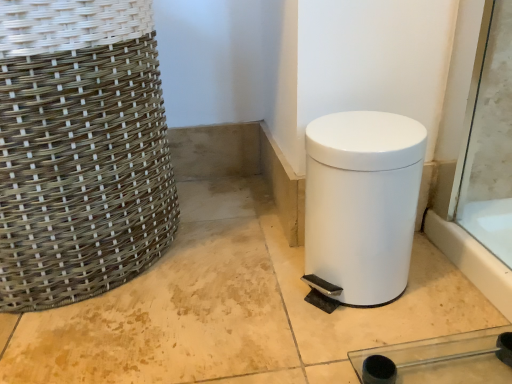
This screenshot has height=384, width=512. What are the coordinates of `white matte waste container at lower right` in the screenshot? It's located at (361, 204).

What is the approximate width of white matte waste container at lower right?

white matte waste container at lower right is 7.00 inches wide.

Describe the element at coordinates (361, 204) in the screenshot. The image size is (512, 384). I see `white matte waste container at lower right` at that location.

Locate an element on the screen. The width and height of the screenshot is (512, 384). woven natural fiber basket at left is located at coordinates (80, 150).

Describe the element at coordinates (80, 150) in the screenshot. I see `woven natural fiber basket at left` at that location.

Where is `white matte waste container at lower right`? white matte waste container at lower right is located at coordinates (361, 204).

Does white matte waste container at lower right appear on the left side of woven natural fiber basket at left?

No, white matte waste container at lower right is not to the left of woven natural fiber basket at left.

Relative to woven natural fiber basket at left, is white matte waste container at lower right in front or behind?

In the image, white matte waste container at lower right appears behind woven natural fiber basket at left.

Which point is more forward, (341, 267) or (140, 271)?

Point (341, 267)

From the image's perspective, which one is positioned lower, white matte waste container at lower right or woven natural fiber basket at left?

white matte waste container at lower right appears lower in the image.

In the scene shown: From a real-world perspective, between white matte waste container at lower right and woven natural fiber basket at left, who is vertically lower?

From a 3D spatial view, white matte waste container at lower right is below.

Is white matte waste container at lower right thinner than woven natural fiber basket at left?

Yes.

Is white matte waste container at lower right shorter than woven natural fiber basket at left?

Yes, white matte waste container at lower right is shorter than woven natural fiber basket at left.

Is white matte waste container at lower right smaller than woven natural fiber basket at left?

Indeed, white matte waste container at lower right has a smaller size compared to woven natural fiber basket at left.

Is white matte waste container at lower right inside the boundaries of woven natural fiber basket at left, or outside?

white matte waste container at lower right lies outside woven natural fiber basket at left.

Is white matte waste container at lower right in contact with woven natural fiber basket at left?

No, white matte waste container at lower right is not touching woven natural fiber basket at left.

Could you tell me if white matte waste container at lower right is facing woven natural fiber basket at left?

No, white matte waste container at lower right is not aimed at woven natural fiber basket at left.

Locate an element on the screen. This screenshot has height=384, width=512. waste container behind the woven natural fiber basket at left is located at coordinates (361, 204).

Considering the relative positions of woven natural fiber basket at left and white matte waste container at lower right in the image provided, is woven natural fiber basket at left to the left or to the right of white matte waste container at lower right?

Based on their positions, woven natural fiber basket at left is located to the left of white matte waste container at lower right.

Is woven natural fiber basket at left in front of or behind white matte waste container at lower right in the image?

woven natural fiber basket at left is in front of white matte waste container at lower right.

Between point (135, 241) and point (381, 199), which one is positioned in front?

The point (381, 199) is closer to the camera.

From the image's perspective, which is above, woven natural fiber basket at left or white matte waste container at lower right?

woven natural fiber basket at left.

From a real-world perspective, who is located lower, woven natural fiber basket at left or white matte waste container at lower right?

white matte waste container at lower right, from a real-world perspective.

Does woven natural fiber basket at left have a lesser width compared to white matte waste container at lower right?

No.

Can you confirm if woven natural fiber basket at left is taller than white matte waste container at lower right?

Yes, woven natural fiber basket at left is taller than white matte waste container at lower right.

Between woven natural fiber basket at left and white matte waste container at lower right, which one has larger size?

With larger size is woven natural fiber basket at left.

Is woven natural fiber basket at left positioned beyond the bounds of white matte waste container at lower right?

woven natural fiber basket at left is positioned outside white matte waste container at lower right.

Looking at this image, is the surface of woven natural fiber basket at left in direct contact with white matte waste container at lower right?

No, woven natural fiber basket at left is not next to white matte waste container at lower right.

Does woven natural fiber basket at left turn towards white matte waste container at lower right?

No, woven natural fiber basket at left does not turn towards white matte waste container at lower right.

What's the angular difference between woven natural fiber basket at left and white matte waste container at lower right's facing directions?

They differ by 0.151 degrees in their facing directions.

Where is `waste container located behind the woven natural fiber basket at left`? waste container located behind the woven natural fiber basket at left is located at coordinates (361, 204).

You are a GUI agent. You are given a task and a screenshot of the screen. Output one action in this format:
    pyautogui.click(x=<x>, y=<y>)
    Task: Click on the waste container behind the woven natural fiber basket at left
    The image size is (512, 384).
    Given the screenshot: What is the action you would take?
    pyautogui.click(x=361, y=204)

Identify the location of basket that is on the left side of white matte waste container at lower right. (80, 150).